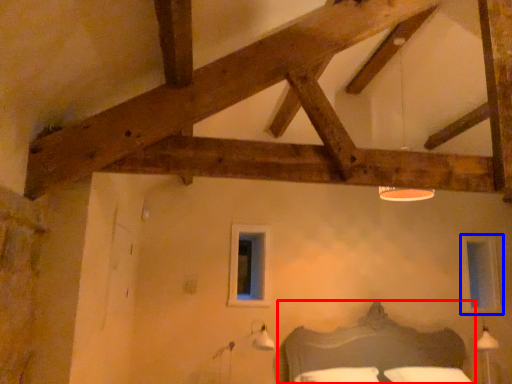
Question: Which of the following is the farthest to the observer, bed (highlighted by a red box) or window (highlighted by a blue box)?

Choices:
 (A) bed
 (B) window

Answer: (B)